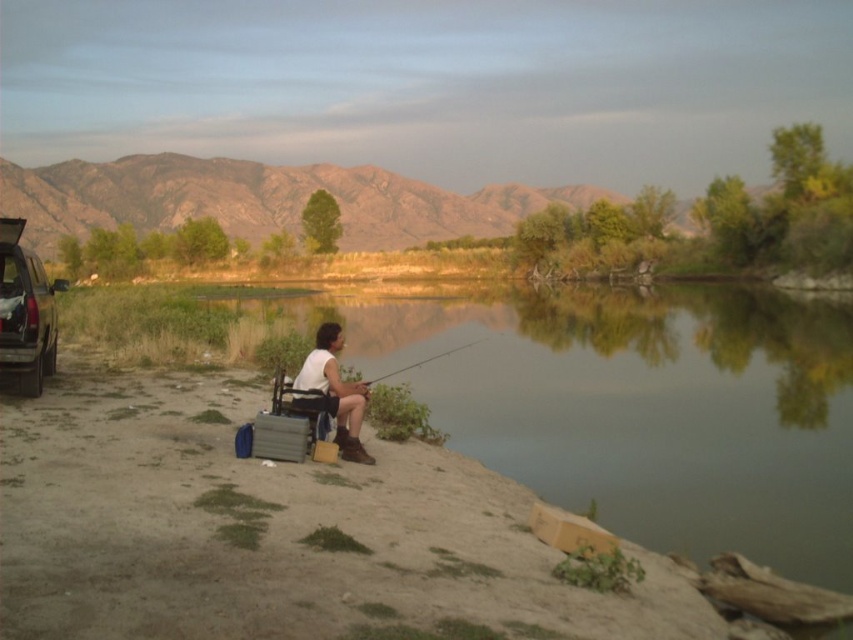
Question: Estimate the real-world distances between objects in this image. Which object is farther from the metallic silver suv at left?

Choices:
 (A) smooth fiberglass rod at center
 (B) clear water at lower center
 (C) white matte shirt at center

Answer: (B)

Question: Can you confirm if clear water at lower center is positioned to the right of smooth fiberglass rod at center?

Choices:
 (A) no
 (B) yes

Answer: (B)

Question: Which point appears closest to the camera in this image?

Choices:
 (A) (764, 339)
 (B) (383, 376)
 (C) (24, 301)
 (D) (352, 442)

Answer: (D)

Question: Which of the following is the closest to the observer?

Choices:
 (A) (18, 284)
 (B) (334, 406)
 (C) (485, 401)

Answer: (B)

Question: Can you confirm if clear water at lower center is positioned to the right of smooth fiberglass rod at center?

Choices:
 (A) yes
 (B) no

Answer: (A)

Question: From the image, what is the correct spatial relationship of white matte shirt at center in relation to smooth fiberglass rod at center?

Choices:
 (A) right
 (B) left

Answer: (B)